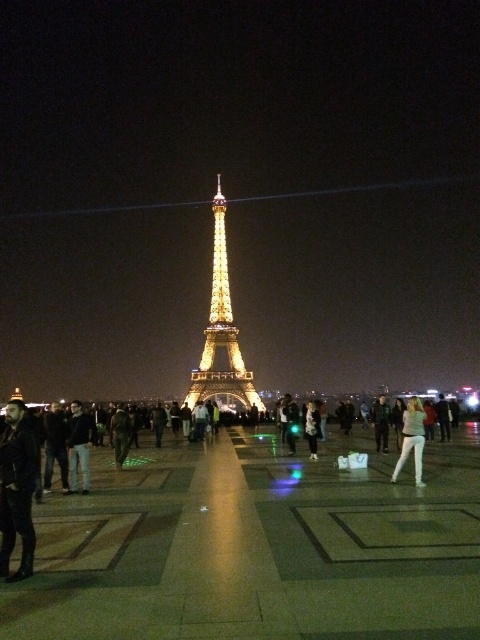
Question: Can you confirm if gold metallic eiffel tower at center is positioned below dark brown leather jacket at lower left?

Choices:
 (A) yes
 (B) no

Answer: (B)

Question: Which object appears farthest from the camera in this image?

Choices:
 (A) dark brown leather jacket at lower left
 (B) gold metallic eiffel tower at center
 (C) polished stone plaza at center
 (D) white fabric pants at lower right

Answer: (D)

Question: Which of these objects is positioned farthest from the polished stone plaza at center?

Choices:
 (A) gold metallic eiffel tower at center
 (B) dark brown leather jacket at lower left

Answer: (A)

Question: Which object appears closest to the camera in this image?

Choices:
 (A) polished stone plaza at center
 (B) dark brown leather jacket at lower left
 (C) gold metallic eiffel tower at center
 (D) white fabric pants at lower right

Answer: (A)

Question: From the image, what is the correct spatial relationship of polished stone plaza at center in relation to gold metallic eiffel tower at center?

Choices:
 (A) left
 (B) right

Answer: (B)

Question: Can you confirm if dark brown leather jacket at lower left is positioned to the right of white fabric pants at lower right?

Choices:
 (A) yes
 (B) no

Answer: (B)